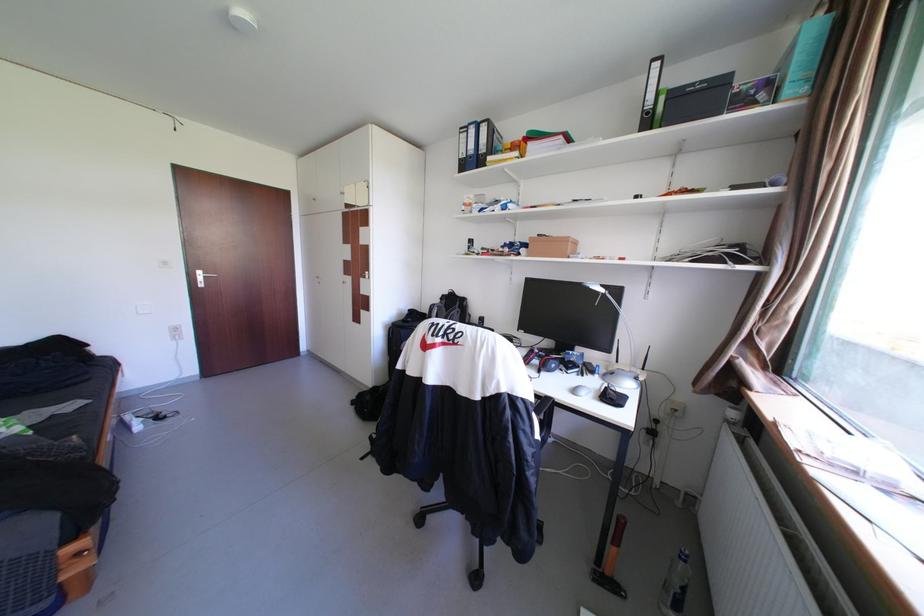
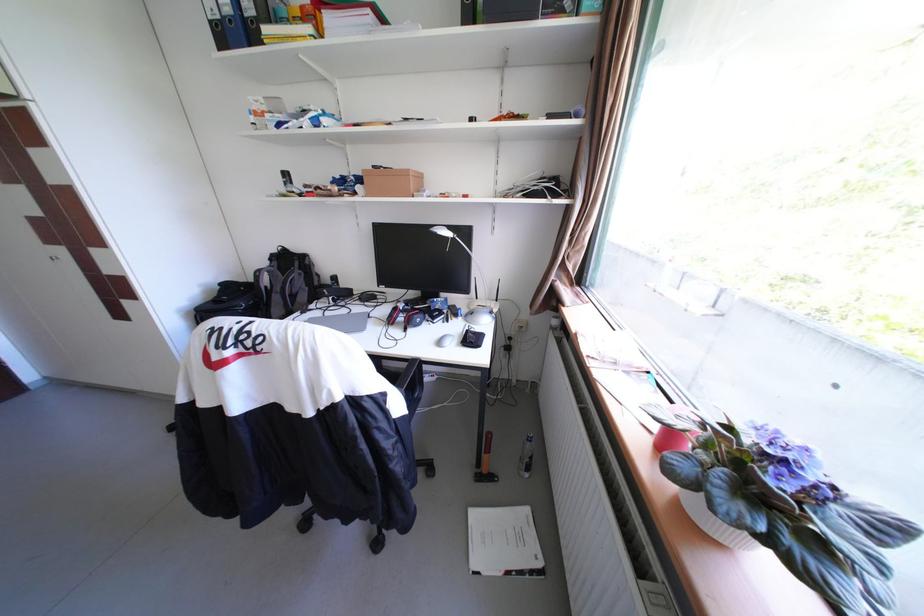
The first image is from the beginning of the video and the second image is from the end. How did the camera likely rotate when shooting the video?

The camera rotated toward right-down.